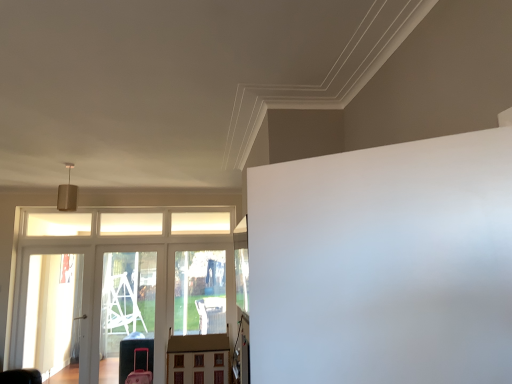
Question: Is point (125, 329) positioned closer to the camera than point (81, 258)?

Choices:
 (A) closer
 (B) farther

Answer: (B)

Question: Is transparent plastic elevator at lower left in front of or behind transparent glass screen door at left, which is counted as the first screen door, starting from the left, in the image?

Choices:
 (A) behind
 (B) front

Answer: (B)

Question: Which is farther from the wooden dollhouse at center?

Choices:
 (A) transparent plastic screen door at left, which ranks as the first screen door in right-to-left order
 (B) transparent glass screen door at left, the 2th screen door in the right-to-left sequence
 (C) transparent plastic elevator at lower left

Answer: (B)

Question: Estimate the real-world distances between objects in this image. Which object is farther from the transparent glass screen door at left, which is counted as the first screen door, starting from the left?

Choices:
 (A) transparent plastic screen door at left, which is the second screen door from left to right
 (B) wooden dollhouse at center
 (C) transparent plastic elevator at lower left

Answer: (B)